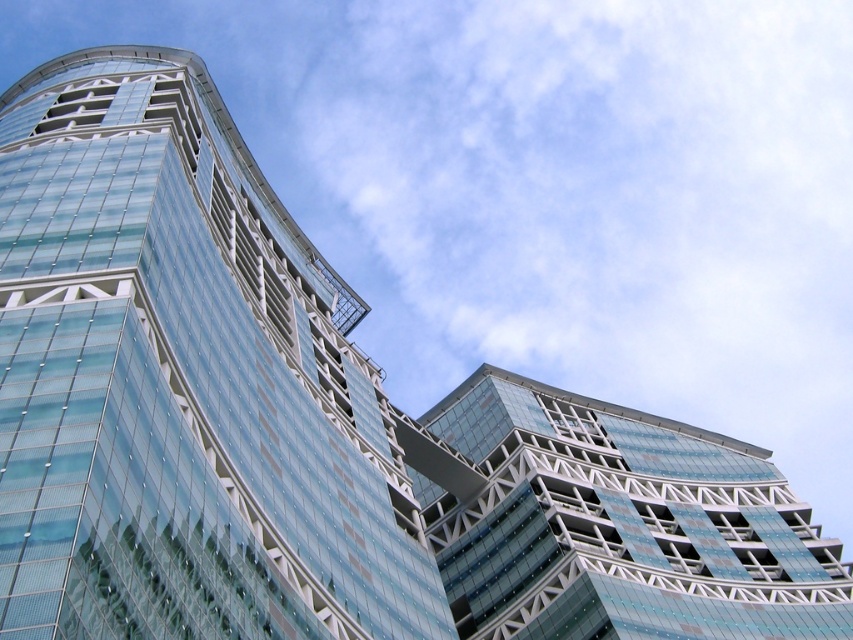
Question: Which of the following is the closest to the observer?

Choices:
 (A) transparent glass building at upper right
 (B) transparent glass building at center

Answer: (B)

Question: Does transparent glass building at center have a smaller size compared to transparent glass building at upper right?

Choices:
 (A) no
 (B) yes

Answer: (A)

Question: Does transparent glass building at center lie in front of transparent glass building at upper right?

Choices:
 (A) yes
 (B) no

Answer: (A)

Question: Which point is farther from the camera taking this photo?

Choices:
 (A) (332, 273)
 (B) (554, 556)

Answer: (A)

Question: Is transparent glass building at center to the right of transparent glass building at upper right from the viewer's perspective?

Choices:
 (A) yes
 (B) no

Answer: (B)